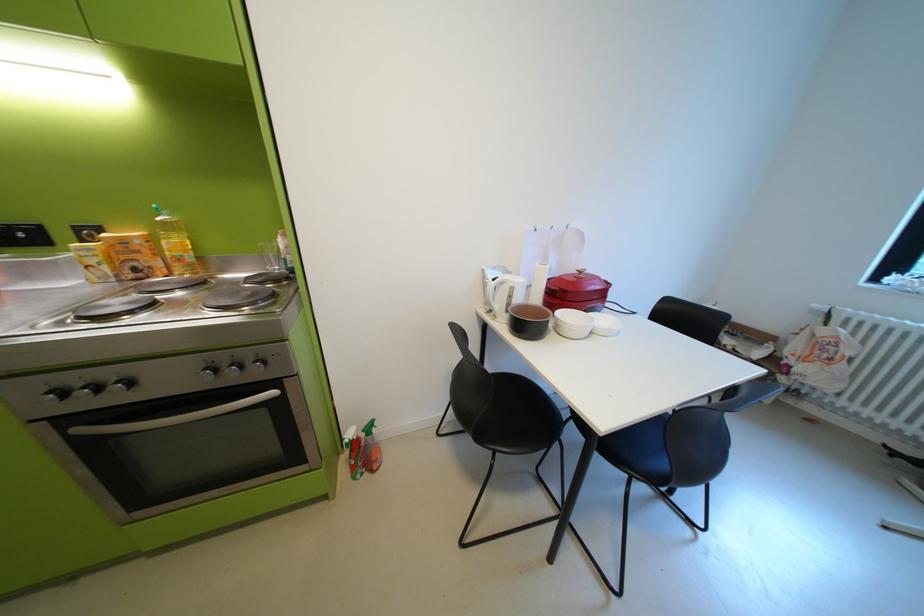
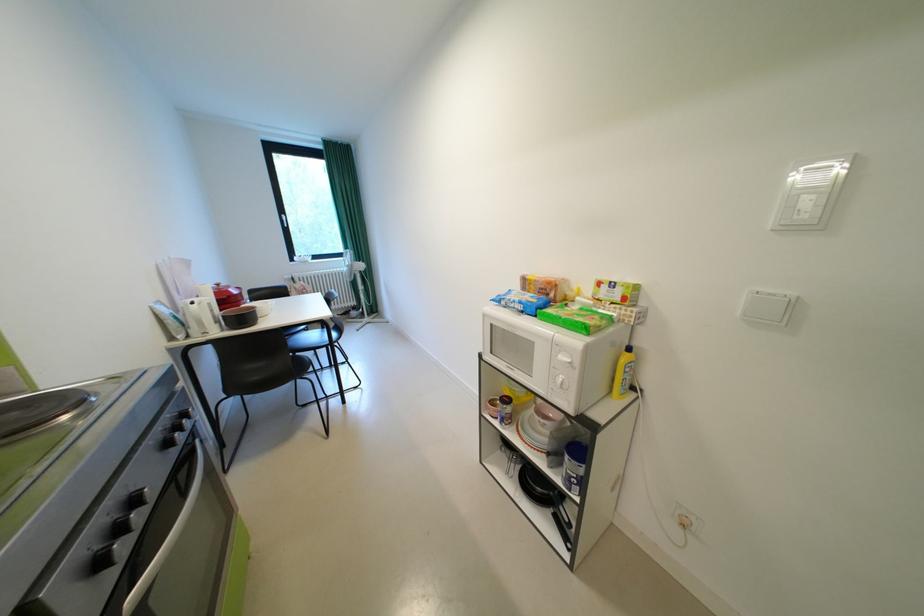
Locate, in the second image, the point that corresponds to [590,273] in the first image.

(228, 286)